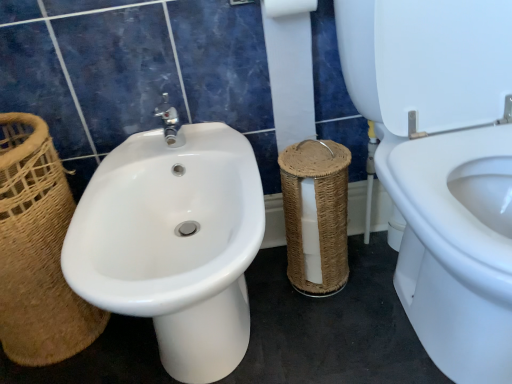
Question: Does white glossy bidet at left lie in front of white paper at center?

Choices:
 (A) no
 (B) yes

Answer: (B)

Question: From a real-world perspective, is white glossy bidet at left positioned over white paper at center based on gravity?

Choices:
 (A) no
 (B) yes

Answer: (A)

Question: Is white glossy bidet at left oriented towards white paper at center?

Choices:
 (A) yes
 (B) no

Answer: (B)

Question: Does white glossy bidet at left have a smaller size compared to white paper at center?

Choices:
 (A) yes
 (B) no

Answer: (B)

Question: Would you consider white glossy bidet at left to be distant from white paper at center?

Choices:
 (A) no
 (B) yes

Answer: (A)

Question: Which is correct: white glossy bidet at left is inside woven brown basket at center, or outside of it?

Choices:
 (A) outside
 (B) inside

Answer: (A)

Question: From a real-world perspective, is white glossy bidet at left positioned above or below woven brown basket at center?

Choices:
 (A) above
 (B) below

Answer: (A)

Question: Considering the positions of point (432, 337) and point (337, 284), is point (432, 337) closer or farther from the camera than point (337, 284)?

Choices:
 (A) farther
 (B) closer

Answer: (B)

Question: Relative to woven brown basket at center, is white glossy bidet at left in front or behind?

Choices:
 (A) behind
 (B) front

Answer: (B)

Question: In terms of width, does woven brown basket at center look wider or thinner when compared to white paper at center?

Choices:
 (A) thin
 (B) wide

Answer: (B)

Question: From the image's perspective, is woven brown basket at center located above or below white paper at center?

Choices:
 (A) below
 (B) above

Answer: (A)

Question: Looking at the image, does woven brown basket at center seem bigger or smaller compared to white paper at center?

Choices:
 (A) small
 (B) big

Answer: (B)

Question: Considering the positions of point [x=284, y=205] and point [x=303, y=41], is point [x=284, y=205] closer or farther from the camera than point [x=303, y=41]?

Choices:
 (A) closer
 (B) farther

Answer: (B)

Question: Would you say white paper at center is to the left or to the right of brown wicker basket at left in the picture?

Choices:
 (A) left
 (B) right

Answer: (B)

Question: From a real-world perspective, is white paper at center above or below brown wicker basket at left?

Choices:
 (A) below
 (B) above

Answer: (B)